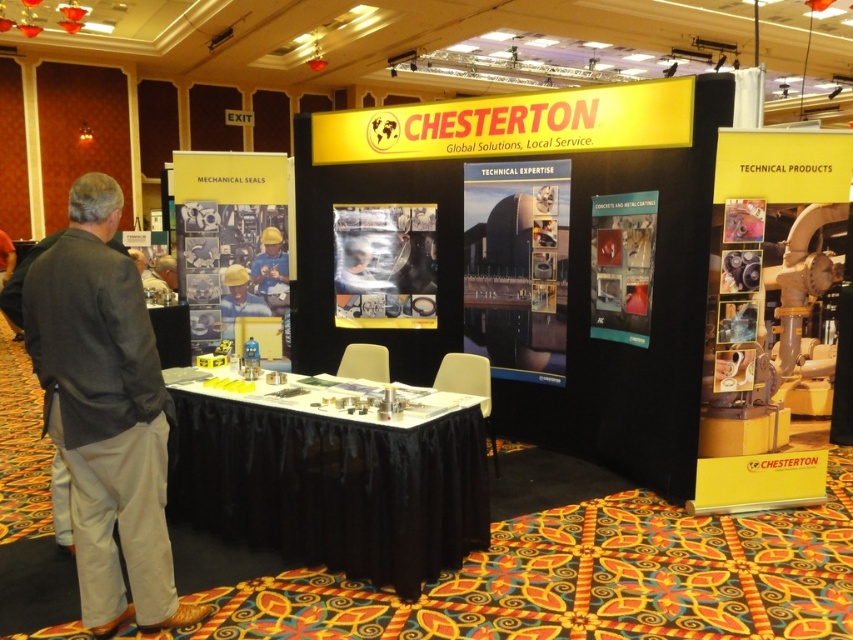
You are standing at the Chesterton trade show booth and notice two points marked on the mechanical seals section. Which point is closer to you, point (218,464) or point (90,550)?

Point (90,550) is closer to you because it is in front of point (218,464).

You are standing at the Chesterton trade show booth and notice two points marked on the floor. The first point is at coordinates point (442,486) and the second is at point (229,307). Which point is closer to you as you face the booth entrance?

Point (442,486) is in front of point (229,307), so it is closer to you as you face the booth entrance.

You are an attendee at the Chesterton trade show booth. You notice the gray fabric pants at left and the yellow hard hat at center. Which item is located below the other?

The gray fabric pants at left is positioned under the yellow hard hat at center, so the gray fabric pants at left are below the yellow hard hat at center.